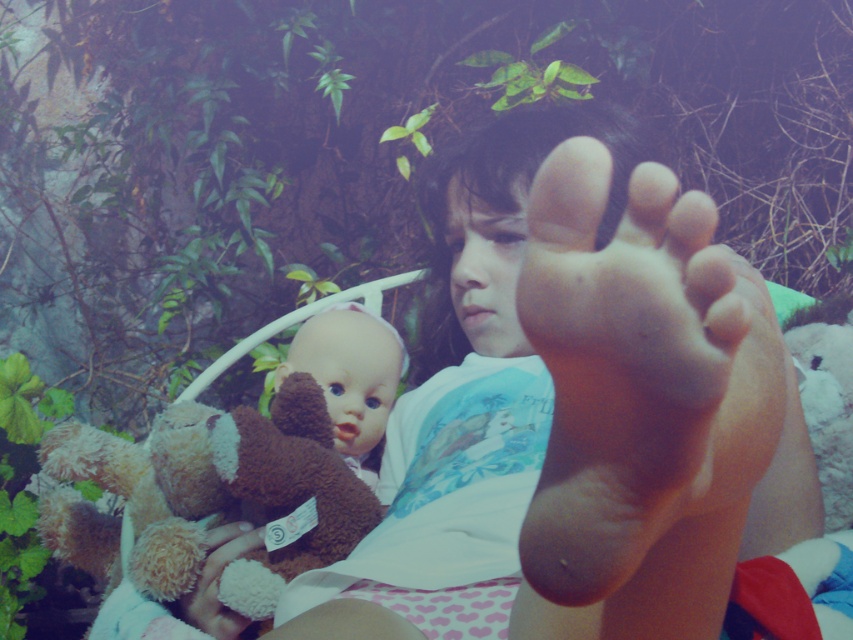
Between point (399, 371) and point (213, 612), which one is positioned in front?

Point (213, 612) is in front.

Is brown plush bear at center further to camera compared to fluffy brown teddy bear at lower left?

That is True.

Does point (347, 388) come farther from viewer compared to point (216, 605)?

Yes, point (347, 388) is farther from viewer.

You are a GUI agent. You are given a task and a screenshot of the screen. Output one action in this format:
    pyautogui.click(x=<x>, y=<y>)
    Task: Click on the brown plush bear at center
    
    Given the screenshot: What is the action you would take?
    pyautogui.click(x=351, y=372)

Does skinny flesh-toned foot at center lie behind brown plush bear at center?

No, skinny flesh-toned foot at center is in front of brown plush bear at center.

You are a GUI agent. You are given a task and a screenshot of the screen. Output one action in this format:
    pyautogui.click(x=<x>, y=<y>)
    Task: Click on the skinny flesh-toned foot at center
    This screenshot has height=640, width=853.
    Given the screenshot: What is the action you would take?
    pos(619,365)

Where is `skinny flesh-toned foot at center`? Image resolution: width=853 pixels, height=640 pixels. skinny flesh-toned foot at center is located at coordinates (619, 365).

The height and width of the screenshot is (640, 853). I want to click on skinny flesh-toned foot at center, so click(x=619, y=365).

Based on the photo, which is more to the left, matte skin foot at center or skinny flesh-toned foot at center?

skinny flesh-toned foot at center is more to the left.

Which of these two, matte skin foot at center or skinny flesh-toned foot at center, stands taller?

With more height is matte skin foot at center.

Between point (523, 234) and point (599, 589), which one is positioned in front?

Positioned in front is point (599, 589).

The width and height of the screenshot is (853, 640). I want to click on matte skin foot at center, so click(x=576, y=388).